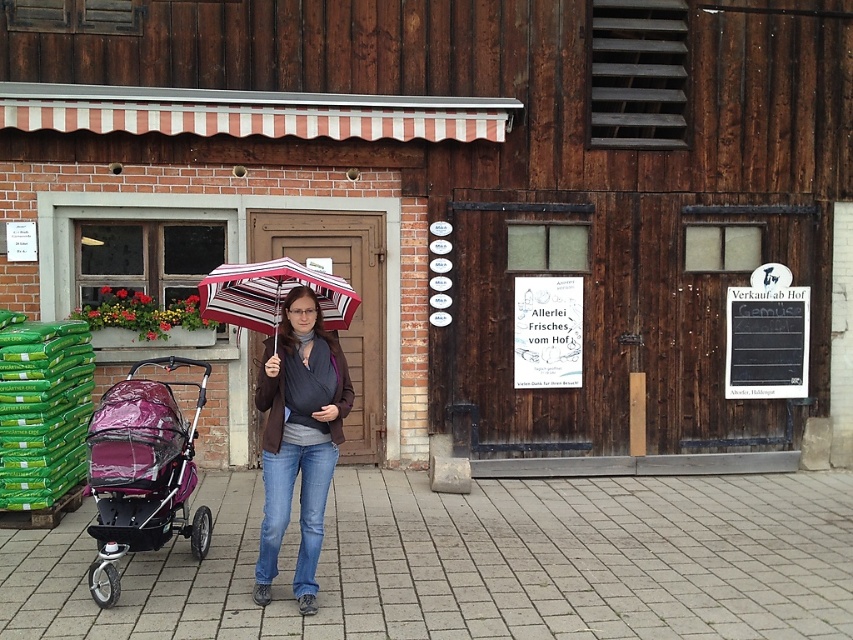
Question: From the image, what is the correct spatial relationship of gray concrete pavement at center in relation to black chalkboard at right?

Choices:
 (A) above
 (B) below

Answer: (B)

Question: Is purple glossy baby carriage at left behind black chalkboard at right?

Choices:
 (A) no
 (B) yes

Answer: (A)

Question: Which of the following is the farthest from the observer?

Choices:
 (A) (206, 518)
 (B) (271, 349)
 (C) (807, 356)

Answer: (C)

Question: Which object is positioned farthest from the purple glossy baby carriage at left?

Choices:
 (A) striped fabric umbrella at center
 (B) black chalkboard at right
 (C) matte brown jacket at center

Answer: (B)

Question: Does purple glossy baby carriage at left have a greater width compared to black chalkboard at right?

Choices:
 (A) no
 (B) yes

Answer: (A)

Question: Based on their relative distances, which object is farther from the purple glossy baby carriage at left?

Choices:
 (A) gray concrete pavement at center
 (B) matte brown jacket at center
 (C) black chalkboard at right
 (D) striped fabric umbrella at center

Answer: (C)